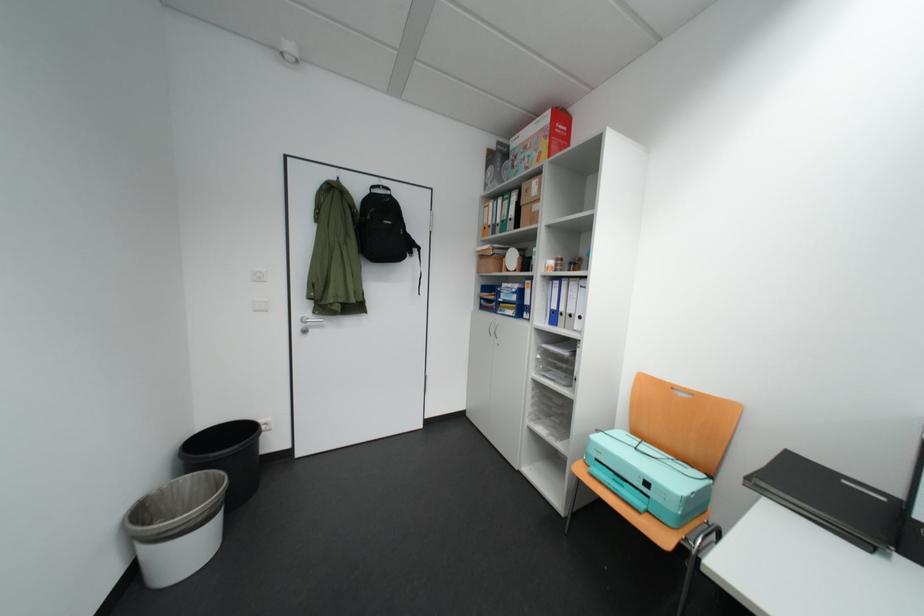
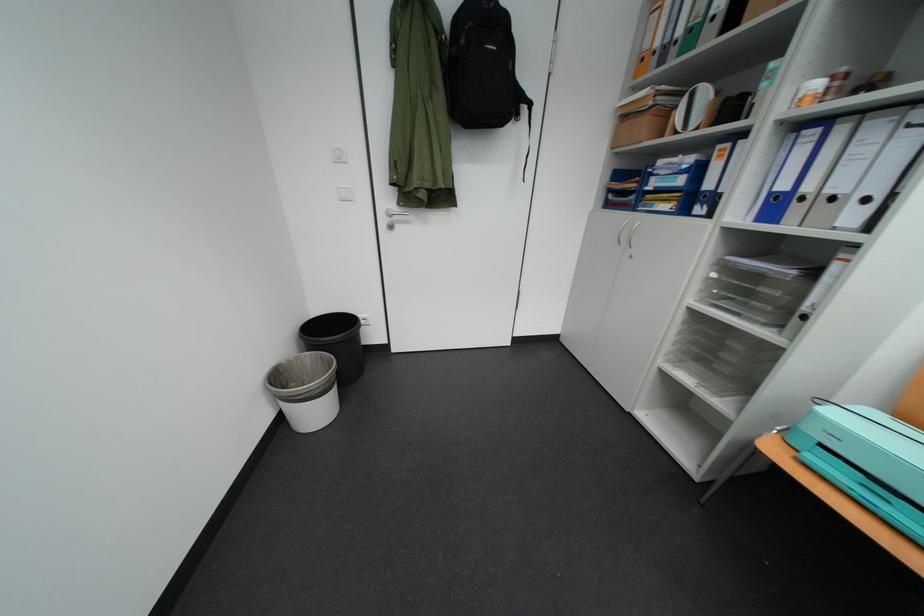
Locate, in the second image, the point that corresponds to [551,358] in the first image.

(724, 277)